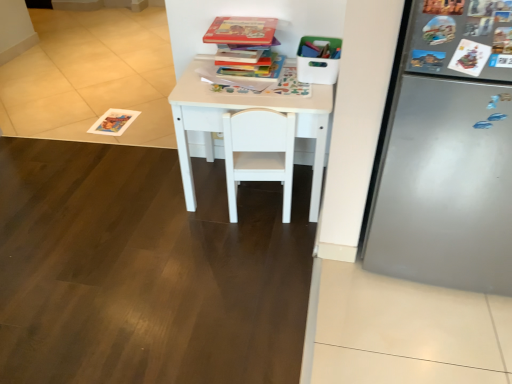
Question: From the image's perspective, is white matte table at center located above or below white matte chair at center?

Choices:
 (A) below
 (B) above

Answer: (B)

Question: Is white matte table at center to the left or to the right of white matte chair at center in the image?

Choices:
 (A) right
 (B) left

Answer: (B)

Question: Estimate the real-world distances between objects in this image. Which object is closer to the hardcover book at center, marked as the first book in a bottom-to-top arrangement?

Choices:
 (A) white matte chair at center
 (B) hardcover book at upper center, the second book viewed from the top
 (C) white matte table at center
 (D) hardcover book at upper center, the 3th book ordered from the bottom

Answer: (B)

Question: Which of these objects is positioned farthest from the white matte chair at center?

Choices:
 (A) white matte table at center
 (B) hardcover book at upper center, the 1th book positioned from the top
 (C) hardcover book at upper center, which appears as the 2th book when ordered from the bottom
 (D) hardcover book at center, marked as the first book in a bottom-to-top arrangement

Answer: (B)